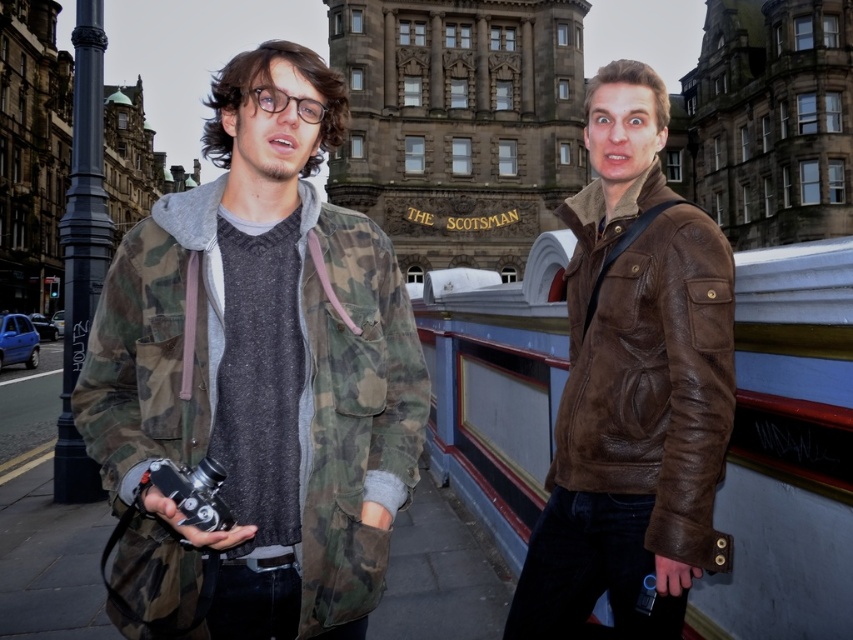
Is camo jacket at center thinner than matte black camera at lower left?

No, camo jacket at center is not thinner than matte black camera at lower left.

What do you see at coordinates (257, 376) in the screenshot? I see `camo jacket at center` at bounding box center [257, 376].

Measure the distance between camo jacket at center and camera.

The distance of camo jacket at center from camera is 121.73 feet.

Find the location of a particular element. Image resolution: width=853 pixels, height=640 pixels. camo jacket at center is located at coordinates (257, 376).

Does point (701, 346) come closer to viewer compared to point (160, 474)?

No, it is behind (160, 474).

Can you confirm if brown leather jacket at right is positioned above matte black camera at lower left?

Indeed, brown leather jacket at right is positioned over matte black camera at lower left.

Is point (589, 369) positioned behind point (189, 470)?

Yes, point (589, 369) is behind point (189, 470).

This screenshot has height=640, width=853. In order to click on brown leather jacket at right in this screenshot , I will do `click(648, 364)`.

Can you confirm if camo jacket at center is smaller than brown leather jacket at right?

No.

Where is `camo jacket at center`? This screenshot has width=853, height=640. camo jacket at center is located at coordinates (257, 376).